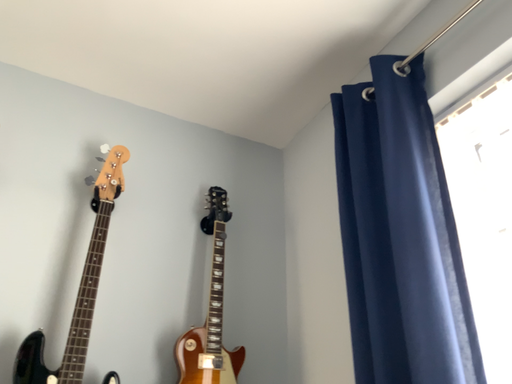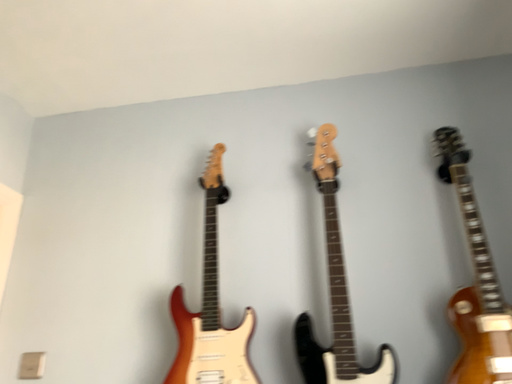
Question: Which way did the camera rotate in the video?

Choices:
 (A) rotated downward
 (B) rotated upward

Answer: (A)